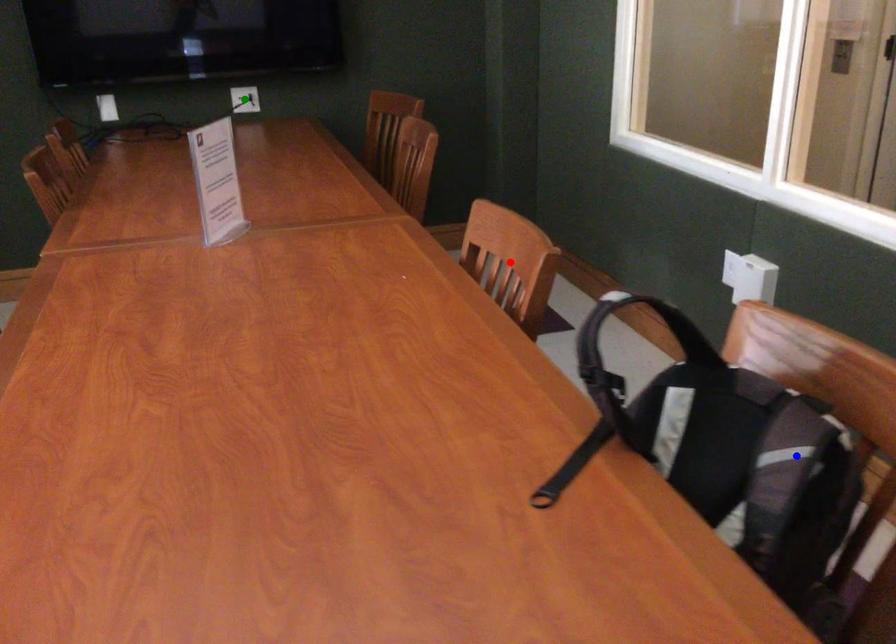
Order these from nearest to farthest:
- green point
- blue point
- red point

blue point
red point
green point